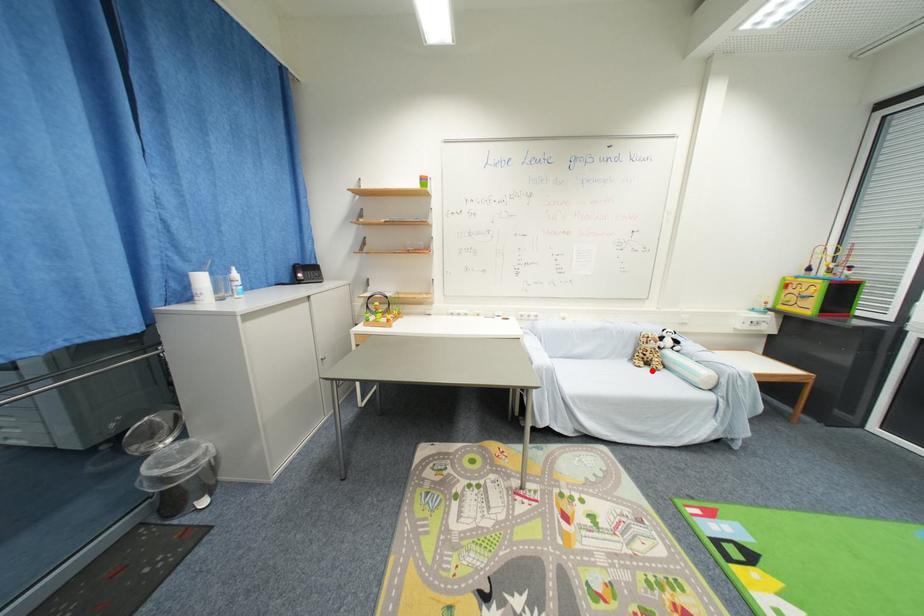
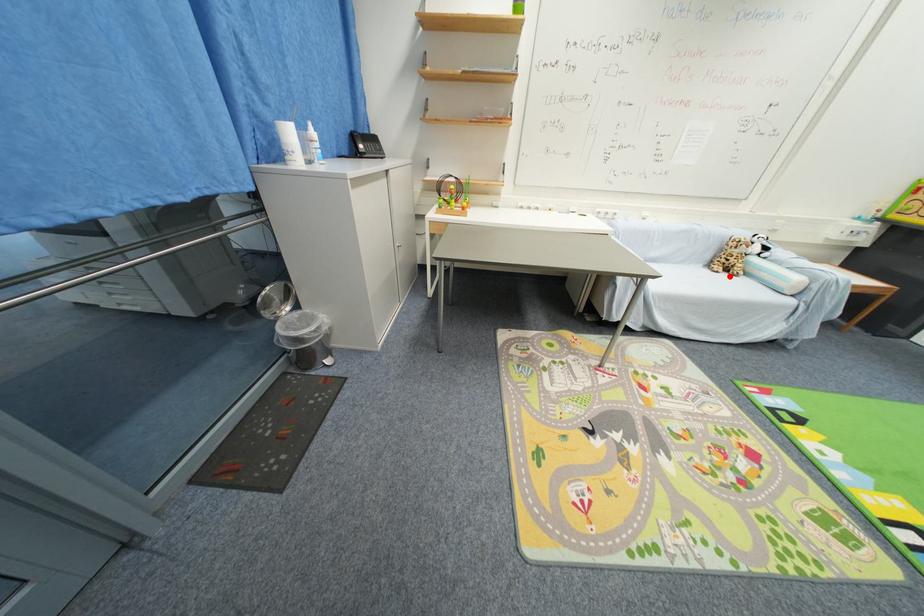
I am providing you with two images of the same scene from different viewpoints. A red point is marked on the first image and another point is marked on the second image. Is the red point in image1 aligned with the point shown in image2?

Yes